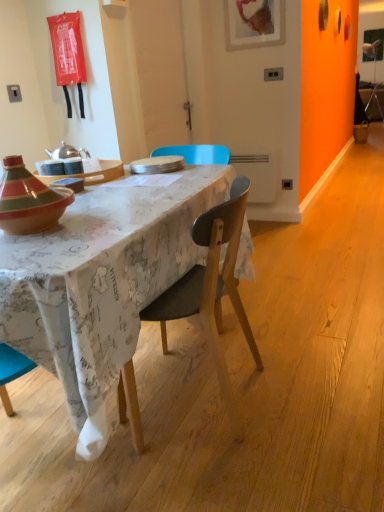
The height and width of the screenshot is (512, 384). In order to click on free space behind wooden chair at center in this screenshot , I will do `click(218, 335)`.